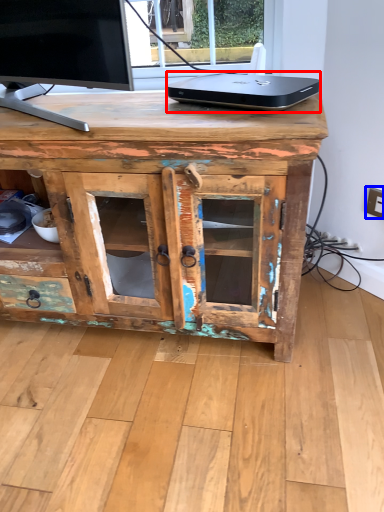
Question: Which of the following is the closest to the observer, laptop (highlighted by a red box) or electric outlet (highlighted by a blue box)?

Choices:
 (A) laptop
 (B) electric outlet

Answer: (A)